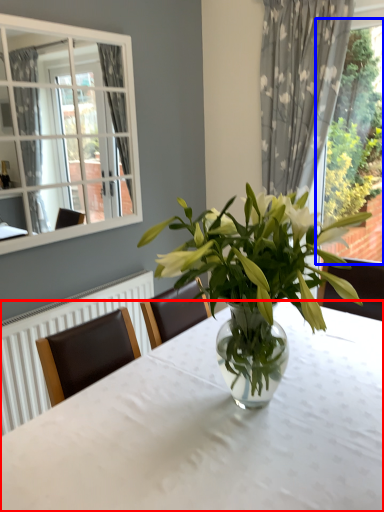
Question: Which object appears farthest to the camera in this image, table (highlighted by a red box) or bay window (highlighted by a blue box)?

Choices:
 (A) table
 (B) bay window

Answer: (B)